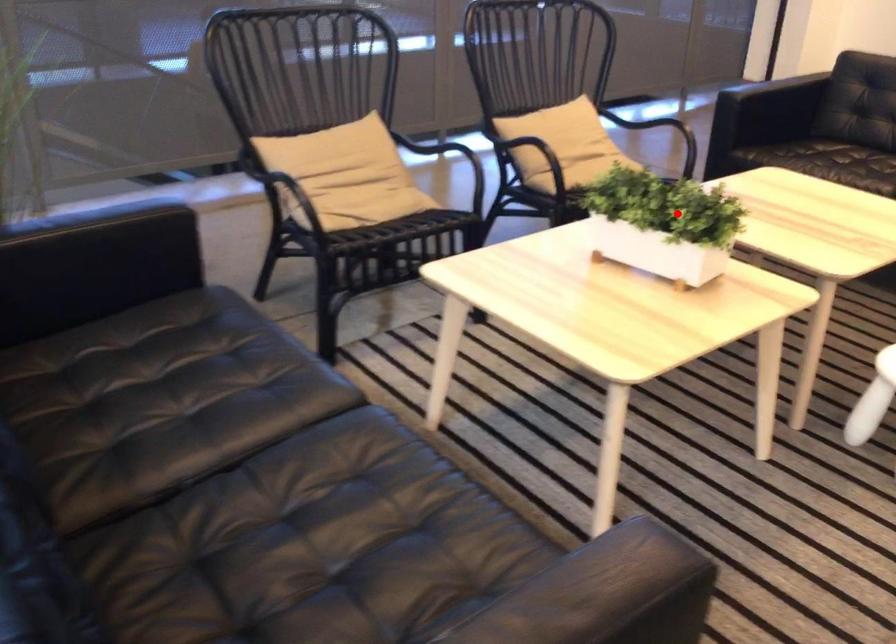
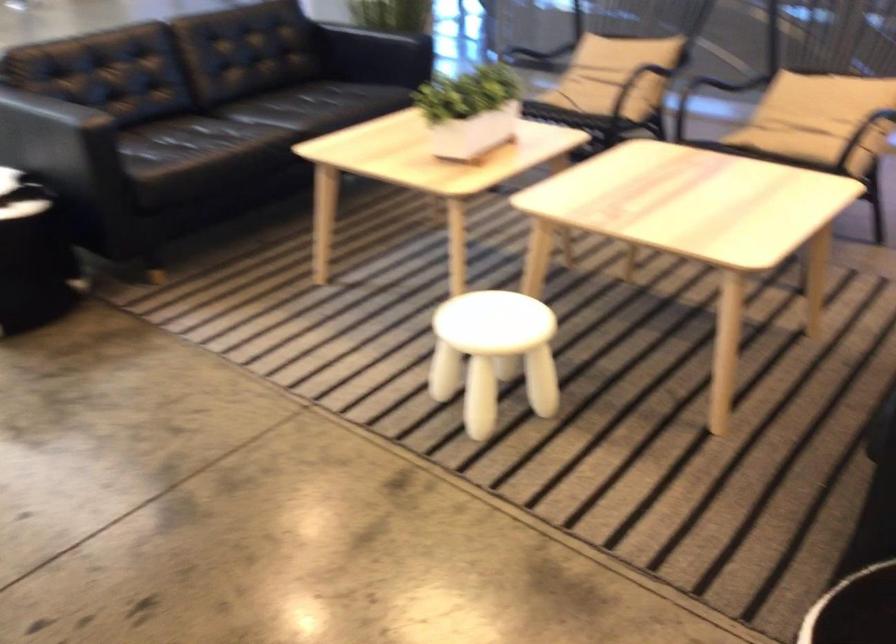
Where in the second image is the point corresponding to the highlighted location from the first image?

(470, 111)